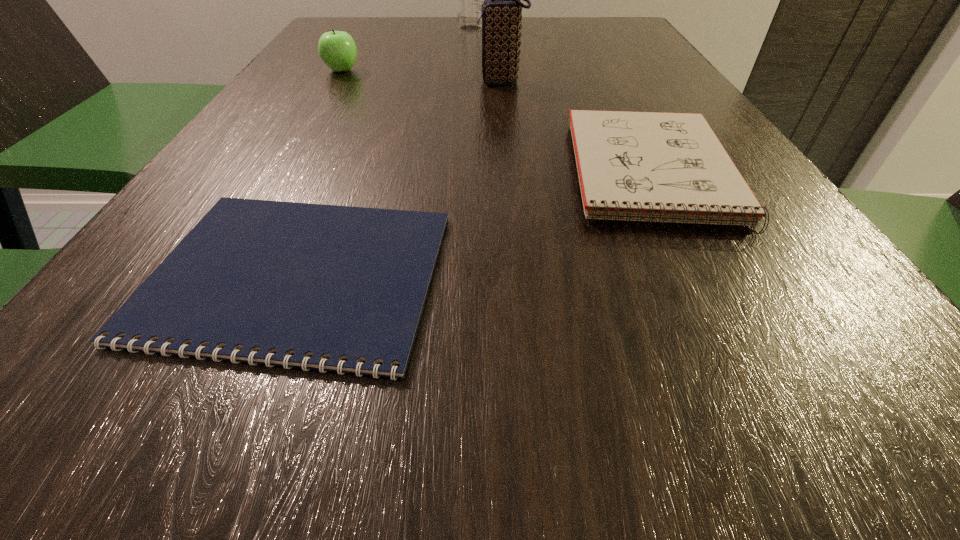
Locate an element on the screen. Image resolution: width=960 pixels, height=540 pixels. vacant space located 0.160m with the zip open on the clutch bag is located at coordinates (399, 82).

Where is `free space located 0.250m with the zip open on the clutch bag`? The image size is (960, 540). free space located 0.250m with the zip open on the clutch bag is located at coordinates (356, 82).

Identify the location of vacant space located 0.110m on the right of the apple. This screenshot has height=540, width=960. (411, 70).

The width and height of the screenshot is (960, 540). What are the coordinates of `free space located on the back of the rightmost object` in the screenshot? It's located at point(589,51).

At what (x,y) coordinates should I click in order to perform the action: click on free space located on the back of the shortest object. Please return your answer as a coordinate pair (x, y). Looking at the image, I should click on (368, 106).

Find the location of `object that is at the far edge`. object that is at the far edge is located at coordinates (469, 0).

At what (x,y) coordinates should I click in order to perform the action: click on apple that is at the left edge. Please return your answer as a coordinate pair (x, y). Looking at the image, I should click on (337, 49).

This screenshot has width=960, height=540. Identify the location of notepad at the left edge. click(257, 281).

Find the location of a particular element. The width and height of the screenshot is (960, 540). object situated at the right edge is located at coordinates (659, 167).

I want to click on vacant space at the far edge, so click(388, 32).